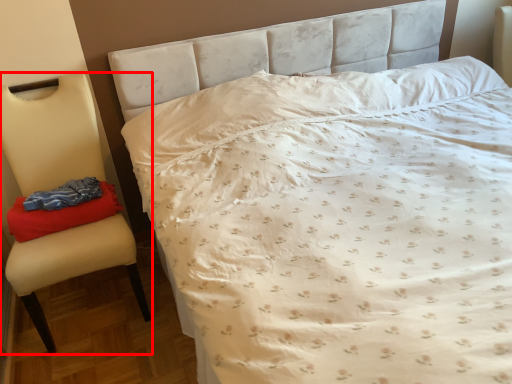
Question: From the image's perspective, where is chair (annotated by the red box) located relative to material?

Choices:
 (A) above
 (B) below

Answer: (B)